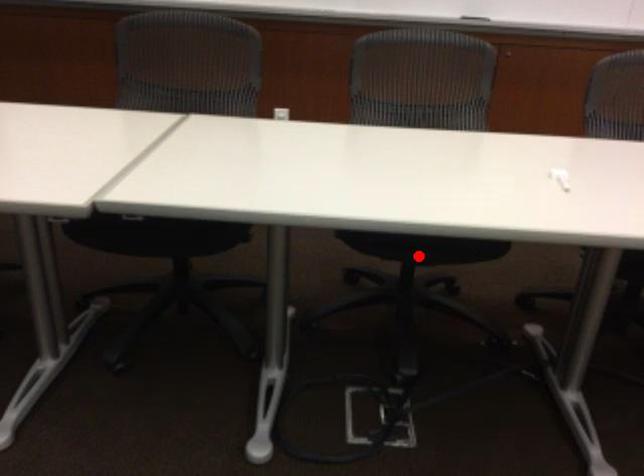
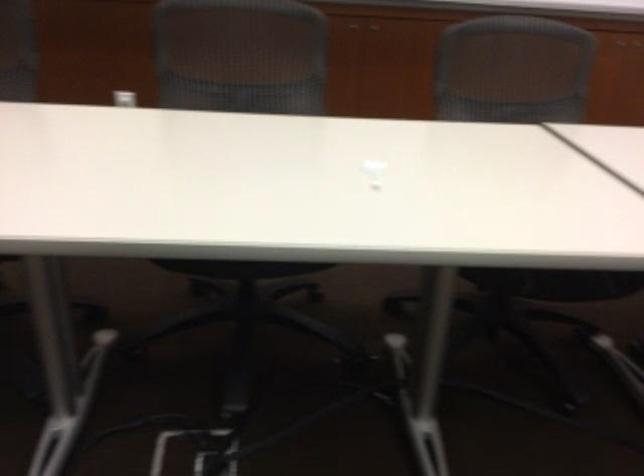
Question: A red point is marked in image1. In image2, is the corresponding 3D point closer to the camera or farther? Reply with the corresponding letter.

Choices:
 (A) The corresponding 3D point is closer.
 (B) The corresponding 3D point is farther.

Answer: (A)